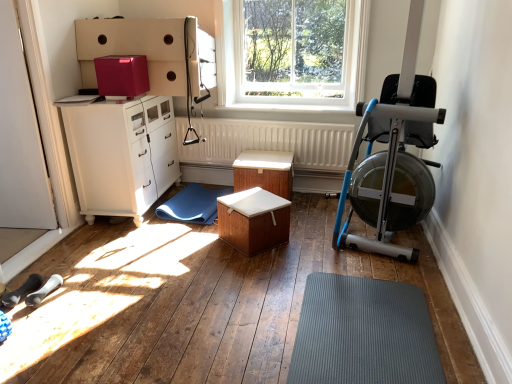
Find the location of a particular element. Image resolution: width=512 pixels, height=384 pixels. silver metallic rowing machine at right is located at coordinates (391, 168).

Describe the element at coordinates (391, 168) in the screenshot. I see `silver metallic rowing machine at right` at that location.

Measure the distance between wooden table at center, which is the first table from back to front, and camera.

The depth of wooden table at center, which is the first table from back to front, is 3.12 meters.

Find the location of `wooden table at center, the 2th table positioned from the front`. wooden table at center, the 2th table positioned from the front is located at coordinates (264, 172).

This screenshot has height=384, width=512. What do you see at coordinates (192, 205) in the screenshot?
I see `blue rubber mat at center, which is the first doormat in top-to-bottom order` at bounding box center [192, 205].

Describe the element at coordinates (268, 142) in the screenshot. I see `white textured radiator at center` at that location.

The image size is (512, 384). I want to click on white glossy screen door at lower left, so click(x=20, y=137).

At what (x,y) coordinates should I click in order to perform the action: click on clear glass window at upper center. Please return your answer as a coordinate pair (x, y). The width and height of the screenshot is (512, 384). Looking at the image, I should click on (289, 63).

Is blue rubber mat at center, positioned as the second doormat in bottom-to-top order, beside white glossy screen door at lower left?

blue rubber mat at center, positioned as the second doormat in bottom-to-top order, and white glossy screen door at lower left are clearly separated.

From their relative heights in the image, would you say blue rubber mat at center, which is the first doormat in top-to-bottom order, is taller or shorter than white glossy screen door at lower left?

blue rubber mat at center, which is the first doormat in top-to-bottom order, is shorter than white glossy screen door at lower left.

Consider the image. Measure the distance from blue rubber mat at center, which is the first doormat in top-to-bottom order, to white glossy screen door at lower left.

They are 3.36 feet apart.

Can you confirm if blue rubber mat at center, the 2th doormat viewed from the right, is bigger than white glossy screen door at lower left?

No, blue rubber mat at center, the 2th doormat viewed from the right, is not bigger than white glossy screen door at lower left.

Are white glossy screen door at lower left and white textured radiator at center located far from each other?

Yes, white glossy screen door at lower left and white textured radiator at center are quite far apart.

From the image's perspective, is white glossy screen door at lower left below white textured radiator at center?

Indeed, from the image's perspective, white glossy screen door at lower left is shown beneath white textured radiator at center.

What's the angular difference between white glossy screen door at lower left and white textured radiator at center's facing directions?

90.6 degrees separate the facing orientations of white glossy screen door at lower left and white textured radiator at center.

Is white glossy screen door at lower left located outside white textured radiator at center?

white glossy screen door at lower left is positioned outside white textured radiator at center.

From a real-world perspective, between glossy cardboard box at upper center and gray rubber mat at lower center, the first doormat positioned from the front, who is vertically higher?

glossy cardboard box at upper center, from a real-world perspective.

Between glossy cardboard box at upper center and gray rubber mat at lower center, the first doormat positioned from the front, which one appears on the left side from the viewer's perspective?

glossy cardboard box at upper center.

Considering the sizes of objects glossy cardboard box at upper center and gray rubber mat at lower center, arranged as the second doormat when viewed from the back, in the image provided, who is shorter, glossy cardboard box at upper center or gray rubber mat at lower center, arranged as the second doormat when viewed from the back,?

Standing shorter between the two is gray rubber mat at lower center, arranged as the second doormat when viewed from the back.

Looking at the image, does glossy cardboard box at upper center seem bigger or smaller compared to gray rubber mat at lower center, the first doormat positioned from the right?

Clearly, glossy cardboard box at upper center is smaller in size than gray rubber mat at lower center, the first doormat positioned from the right.

Does white textured radiator at center have a greater height compared to wooden table at center, which is the first table from back to front?

Yes.

Which is in front, point (212, 150) or point (254, 169)?

The point (254, 169) is more forward.

Locate an element on the screen. The width and height of the screenshot is (512, 384). radiator above the wooden table at center, the 2th table positioned from the front (from a real-world perspective) is located at coordinates (268, 142).

Based on their sizes in the image, would you say wooden table at center, the 2th table positioned from the front, is bigger or smaller than glossy cardboard box at upper center?

Clearly, wooden table at center, the 2th table positioned from the front, is larger in size than glossy cardboard box at upper center.

Is wooden table at center, the 2th table positioned from the front, oriented towards glossy cardboard box at upper center?

No.

From a real-world perspective, does wooden table at center, which is the first table from back to front, stand above glossy cardboard box at upper center?

Incorrect, from a real-world perspective, wooden table at center, which is the first table from back to front, is lower than glossy cardboard box at upper center.

Does wooden table at center, which is the first table from back to front, have a larger size compared to white glossy screen door at lower left?

No.

Is wooden table at center, the 2th table positioned from the front, far away from white glossy screen door at lower left?

Yes, wooden table at center, the 2th table positioned from the front, is far from white glossy screen door at lower left.

Is wooden table at center, the 2th table positioned from the front, thinner than white glossy screen door at lower left?

No, wooden table at center, the 2th table positioned from the front, is not thinner than white glossy screen door at lower left.

Does white glossy screen door at lower left have a lesser height compared to clear glass window at upper center?

Incorrect, the height of white glossy screen door at lower left does not fall short of that of clear glass window at upper center.

How many degrees apart are the facing directions of white glossy screen door at lower left and clear glass window at upper center?

The angle between the facing direction of white glossy screen door at lower left and the facing direction of clear glass window at upper center is 89.9 degrees.

Is white glossy screen door at lower left next to clear glass window at upper center?

Answer: No, white glossy screen door at lower left is not beside clear glass window at upper center.

At what (x,y) coordinates should I click in order to perform the action: click on window that appears on the right of white glossy screen door at lower left. Please return your answer as a coordinate pair (x, y). Looking at the image, I should click on (289, 63).

In order to click on the 1st doormat counting from the right side of the white glossy screen door at lower left in this screenshot , I will do `click(192, 205)`.

In order to click on screen door that appears above the white textured radiator at center (from a real-world perspective) in this screenshot , I will do `click(20, 137)`.

Based on their spatial positions, is clear glass window at upper center or wooden table at center, which is the first table from back to front, further from wooden box at center, acting as the 1th table starting from the front?

Based on the image, clear glass window at upper center appears to be further to wooden box at center, acting as the 1th table starting from the front.

Looking at the image, which one is located closer to white glossy screen door at lower left, glossy cardboard box at upper center or wooden box at center, acting as the 1th table starting from the front?

glossy cardboard box at upper center is closer to white glossy screen door at lower left.

When comparing their distances from wooden table at center, the 2th table positioned from the front, does silver metallic rowing machine at right or clear glass window at upper center seem further?

The object further to wooden table at center, the 2th table positioned from the front, is silver metallic rowing machine at right.

When comparing their distances from gray rubber mat at lower center, acting as the first doormat starting from the bottom, does white glossy screen door at lower left or wooden table at center, which is the first table from back to front, seem further?

The object further to gray rubber mat at lower center, acting as the first doormat starting from the bottom, is white glossy screen door at lower left.

From the image, which object appears to be farther from silver metallic rowing machine at right, blue rubber mat at center, acting as the first doormat starting from the left, or clear glass window at upper center?

Based on the image, blue rubber mat at center, acting as the first doormat starting from the left, appears to be further to silver metallic rowing machine at right.

From the image, which object appears to be farther from silver metallic rowing machine at right, white glossy cabinet at left or blue rubber mat at center, which is the 2th doormat from front to back?

white glossy cabinet at left lies further to silver metallic rowing machine at right than the other object.

Based on their spatial positions, is clear glass window at upper center or wooden box at center, acting as the 1th table starting from the front, further from wooden table at center, the 2th table positioned from the front?

clear glass window at upper center lies further to wooden table at center, the 2th table positioned from the front, than the other object.

Looking at the image, which one is located further to blue rubber mat at center, which is the 2th doormat from front to back, wooden table at center, the 2th table positioned from the front, or gray rubber mat at lower center, the 2th doormat from the left?

Based on the image, gray rubber mat at lower center, the 2th doormat from the left, appears to be further to blue rubber mat at center, which is the 2th doormat from front to back.

Where is `table between clear glass window at upper center and blue rubber mat at center, the 2th doormat viewed from the right, from top to bottom`? table between clear glass window at upper center and blue rubber mat at center, the 2th doormat viewed from the right, from top to bottom is located at coordinates (264, 172).

Locate an element on the screen. baby carriage between clear glass window at upper center and gray rubber mat at lower center, the first doormat positioned from the front, in the vertical direction is located at coordinates (391, 168).

You are a GUI agent. You are given a task and a screenshot of the screen. Output one action in this format:
    pyautogui.click(x=<x>, y=<y>)
    Task: Click on the radiator situated between white glossy cabinet at left and silver metallic rowing machine at right from left to right
    This screenshot has width=512, height=384.
    Given the screenshot: What is the action you would take?
    pyautogui.click(x=268, y=142)

Identify the location of cardboard box between clear glass window at upper center and gray rubber mat at lower center, arranged as the second doormat when viewed from the back, in the up-down direction. The height and width of the screenshot is (384, 512). (122, 75).